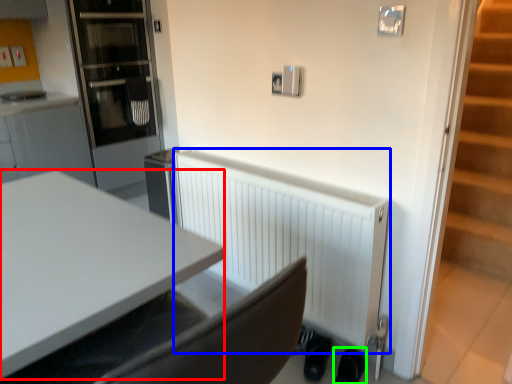
Question: Based on their relative distances, which object is nearer to desk (highlighted by a red box)? Choose from radiator (highlighted by a blue box) and shoe (highlighted by a green box).

Choices:
 (A) radiator
 (B) shoe

Answer: (A)